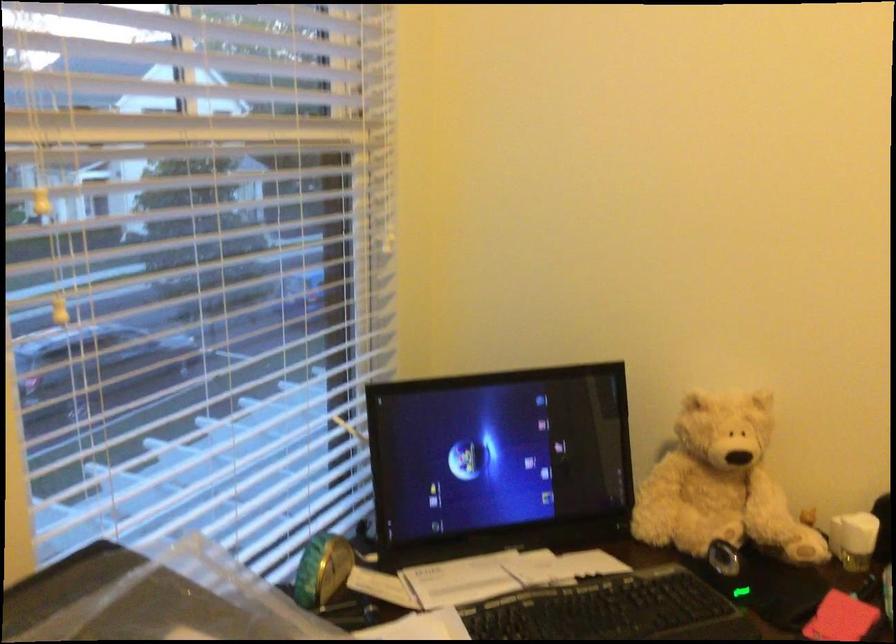
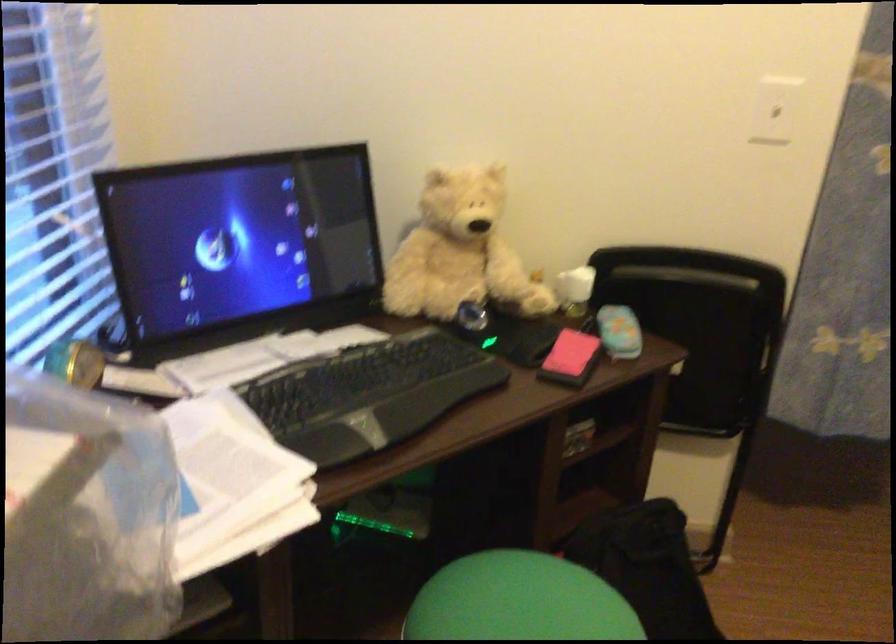
Question: The images are taken continuously from a first-person perspective. In which direction is your viewpoint rotating?

Choices:
 (A) Left
 (B) Right
 (C) Up
 (D) Down

Answer: (B)